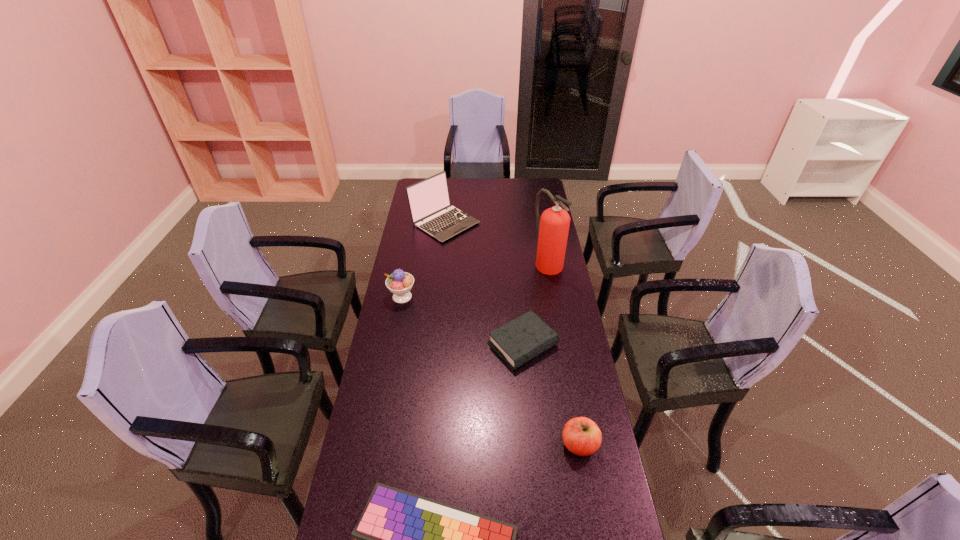
Point out which object is positioned as the fourth nearest to the computer keyboard. Please provide its 2D coordinates. Your answer should be formatted as a tuple, i.e. [(x, y)], where the tuple contains the x and y coordinates of a point satisfying the conditions above.

[(553, 227)]

In order to click on the fourth closest object relative to the fifth shortest object in this screenshot , I will do `click(581, 436)`.

Where is `free space that satisfies the following two spatial constraints: 1. on the front side of the apple; 2. on the right side of the second shortest object`? The height and width of the screenshot is (540, 960). free space that satisfies the following two spatial constraints: 1. on the front side of the apple; 2. on the right side of the second shortest object is located at coordinates (532, 445).

The image size is (960, 540). Identify the location of vacant position in the image that satisfies the following two spatial constraints: 1. at the front screen of the second nearest object; 2. on the right side of the farthest object. (420, 445).

Locate an element on the screen. This screenshot has height=540, width=960. free spot that satisfies the following two spatial constraints: 1. on the front side of the icecream; 2. on the left side of the fourth farthest object is located at coordinates point(393,345).

Find the location of a particular element. Image resolution: width=960 pixels, height=540 pixels. free point that satisfies the following two spatial constraints: 1. at the front screen of the farthest object; 2. on the left side of the second nearest object is located at coordinates (420, 445).